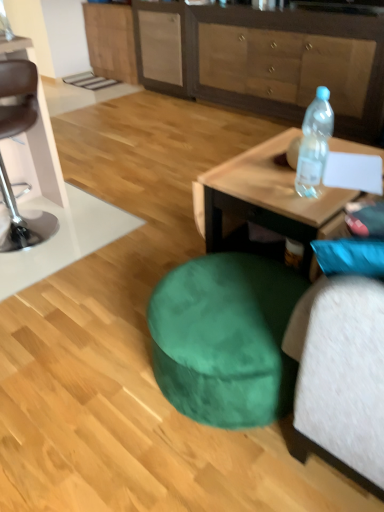
Question: Considering the positions of wooden cabinet at upper center, which is the 1th cabinetry in right-to-left order, and transparent plastic bottle at upper right in the image, is wooden cabinet at upper center, which is the 1th cabinetry in right-to-left order, wider or thinner than transparent plastic bottle at upper right?

Choices:
 (A) wide
 (B) thin

Answer: (A)

Question: Is point (331, 86) positioned closer to the camera than point (309, 183)?

Choices:
 (A) farther
 (B) closer

Answer: (A)

Question: Which of these objects is positioned farthest from the matte wood cabinet at upper center, positioned as the 2th cabinetry in right-to-left order?

Choices:
 (A) velvet green bean bag at lower center
 (B) wooden coffee table at right
 (C) brown leather bar stool at left
 (D) wooden cabinet at upper center, which is the 1th cabinetry in right-to-left order
 (E) transparent plastic bottle at upper right

Answer: (A)

Question: Based on their relative distances, which object is farther from the brown leather bar stool at left?

Choices:
 (A) transparent plastic bottle at upper right
 (B) wooden coffee table at right
 (C) wooden cabinet at upper center, which ranks as the second cabinetry in back-to-front order
 (D) matte wood cabinet at upper center, which appears as the 2th cabinetry when viewed from the front
 (E) velvet green bean bag at lower center

Answer: (D)